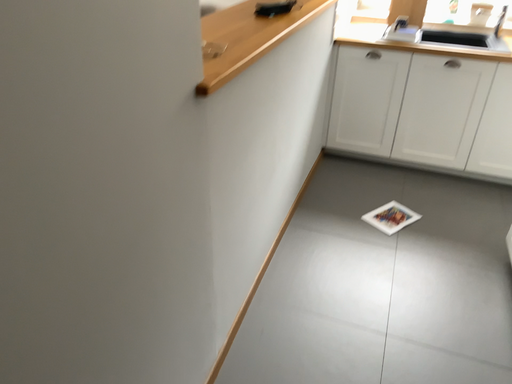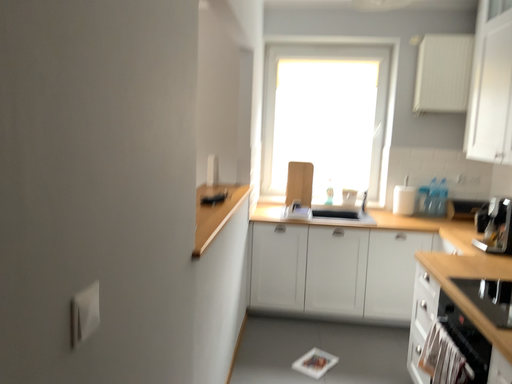
Question: Which way did the camera rotate in the video?

Choices:
 (A) rotated right
 (B) rotated left

Answer: (A)